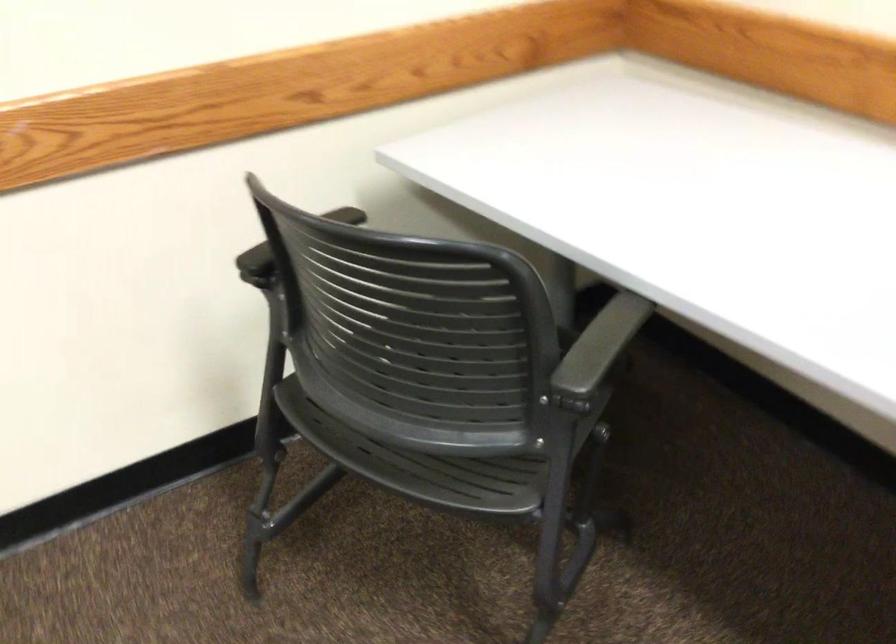
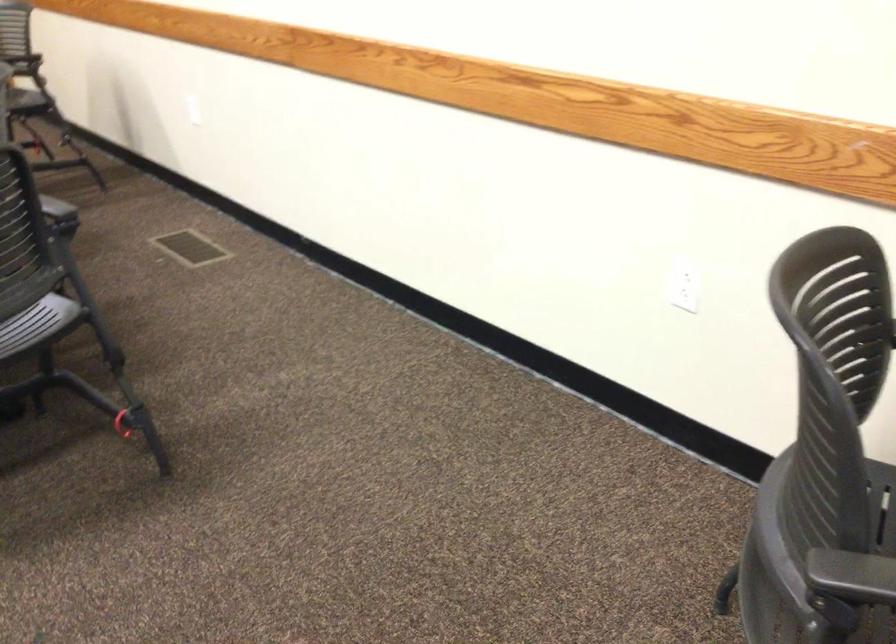
Where in the second image is the point corresponding to [385,408] from the first image?

(881, 547)